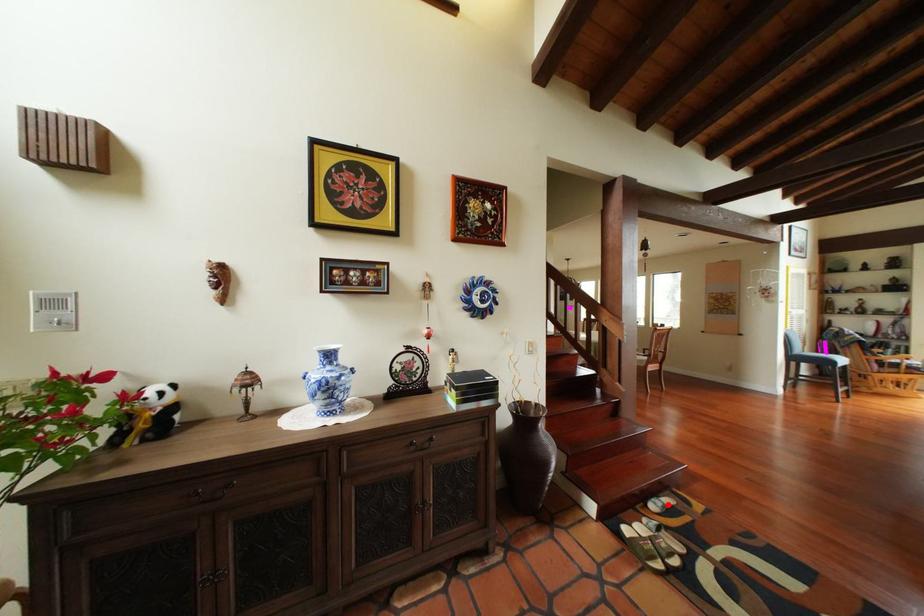
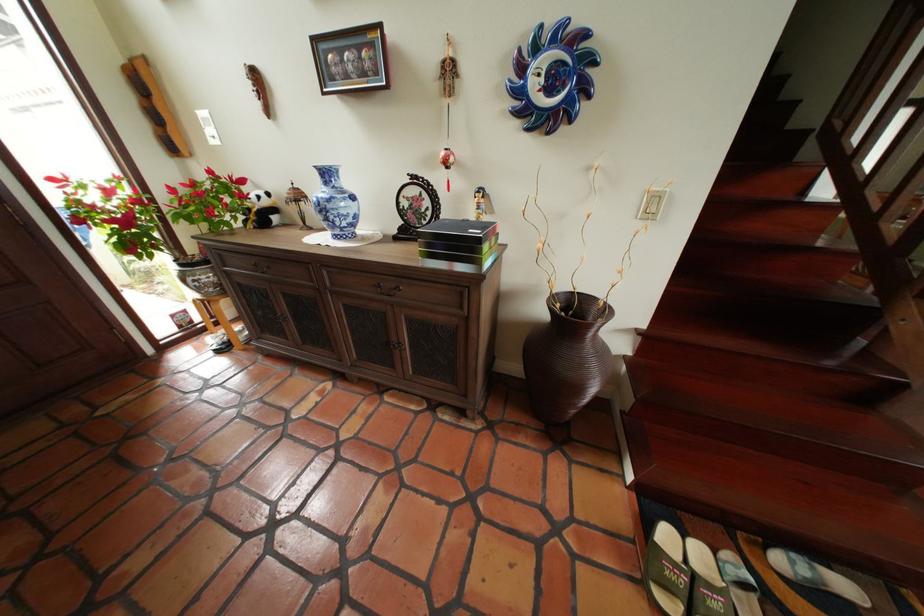
In the second image, find the point that corresponds to the highlighted location in the first image.

(806, 564)